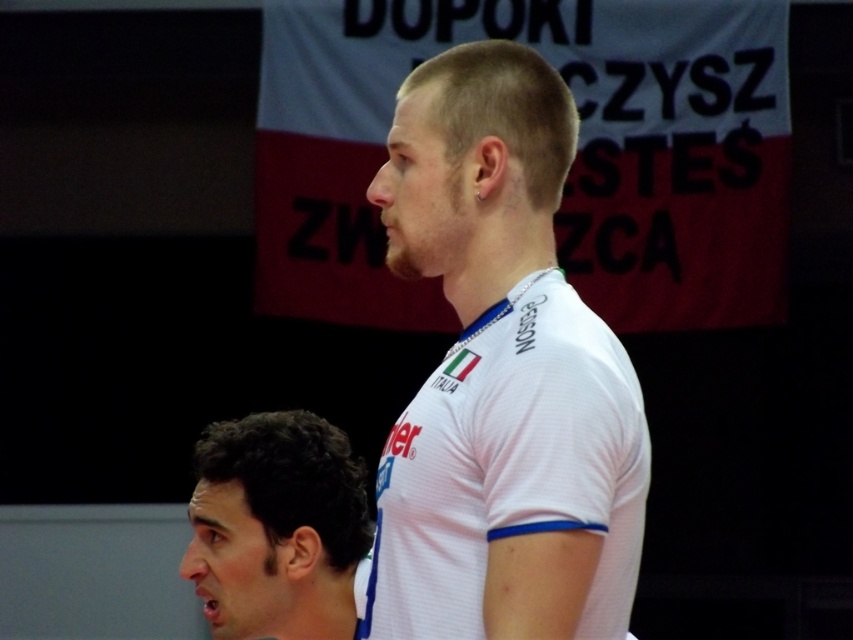
Question: Does white jersey at center appear on the right side of dark curly hair at lower left?

Choices:
 (A) yes
 (B) no

Answer: (A)

Question: Which of the following is the closest to the observer?

Choices:
 (A) (281, 538)
 (B) (466, 339)

Answer: (B)

Question: Which of the following is the closest to the observer?

Choices:
 (A) (346, 595)
 (B) (409, 540)

Answer: (B)

Question: Is white jersey at center to the left of dark curly hair at lower left from the viewer's perspective?

Choices:
 (A) no
 (B) yes

Answer: (A)

Question: Does white jersey at center have a lesser width compared to dark curly hair at lower left?

Choices:
 (A) yes
 (B) no

Answer: (A)